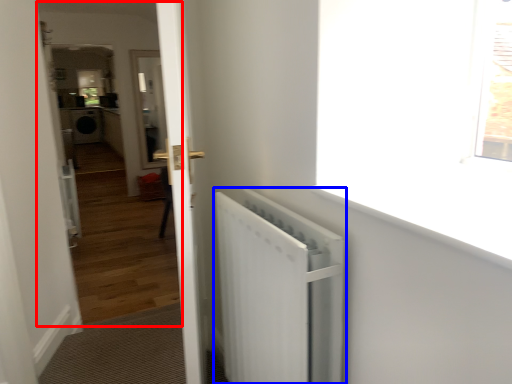
Question: Which of the following is the farthest to the observer, corridor (highlighted by a red box) or radiator (highlighted by a blue box)?

Choices:
 (A) corridor
 (B) radiator

Answer: (A)